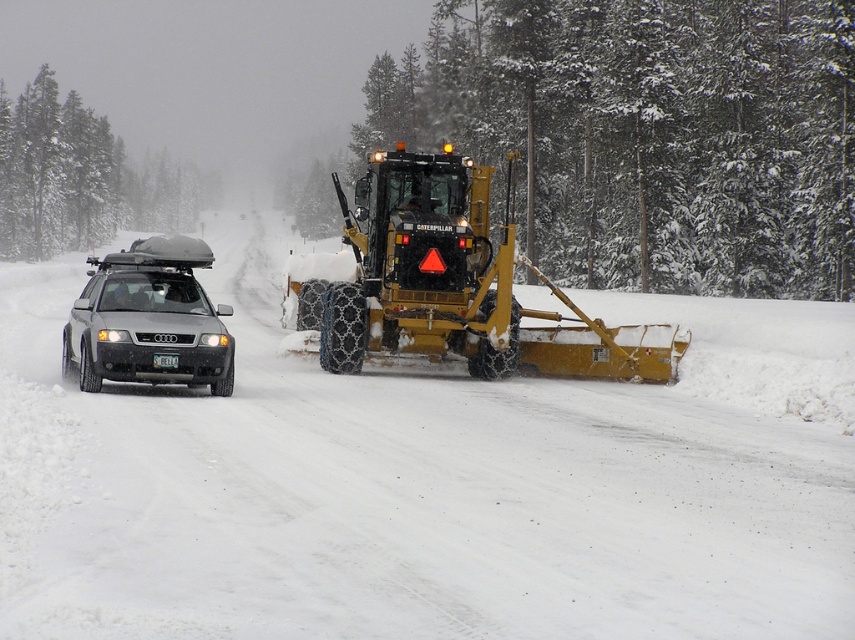
Question: Does yellow metallic snowplow at center lie behind matte black car at left?

Choices:
 (A) no
 (B) yes

Answer: (B)

Question: Among these points, which one is farthest from the camera?

Choices:
 (A) (16, 289)
 (B) (175, 364)
 (C) (175, 237)
 (D) (374, 154)

Answer: (A)

Question: Among these objects, which one is nearest to the camera?

Choices:
 (A) white plastic license plate at center
 (B) yellow metallic snowplow at center
 (C) white powdery snow at center

Answer: (C)

Question: Is yellow metallic snowplow at center positioned before matte black car at left?

Choices:
 (A) no
 (B) yes

Answer: (A)

Question: Can you confirm if white powdery snow at center is smaller than white plastic license plate at center?

Choices:
 (A) no
 (B) yes

Answer: (A)

Question: Which point is farther to the camera?

Choices:
 (A) white powdery snow at center
 (B) matte black car at left

Answer: (B)